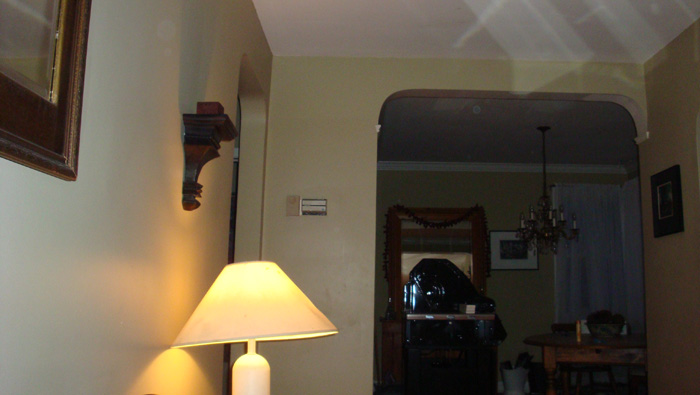
Find the location of a particular element. wall is located at coordinates (99, 291).